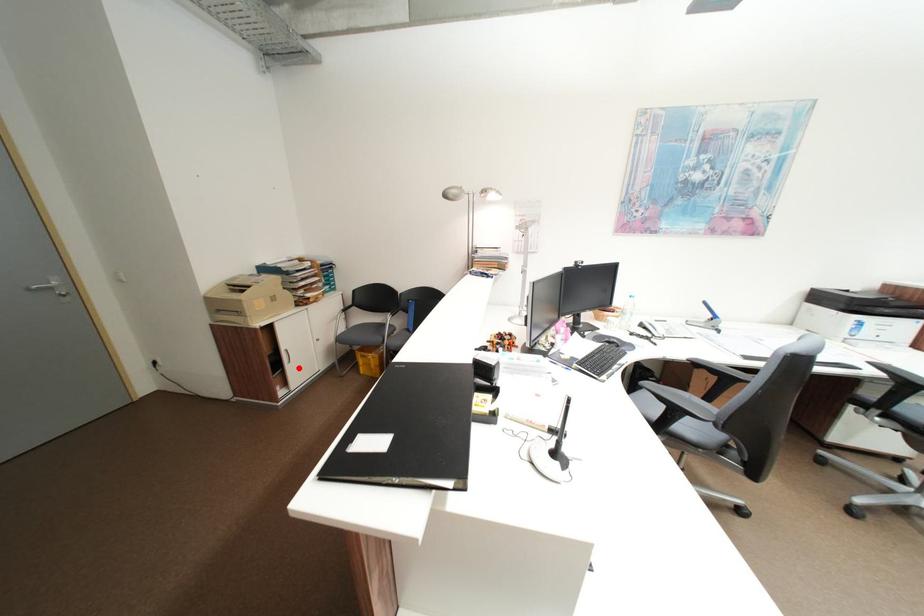
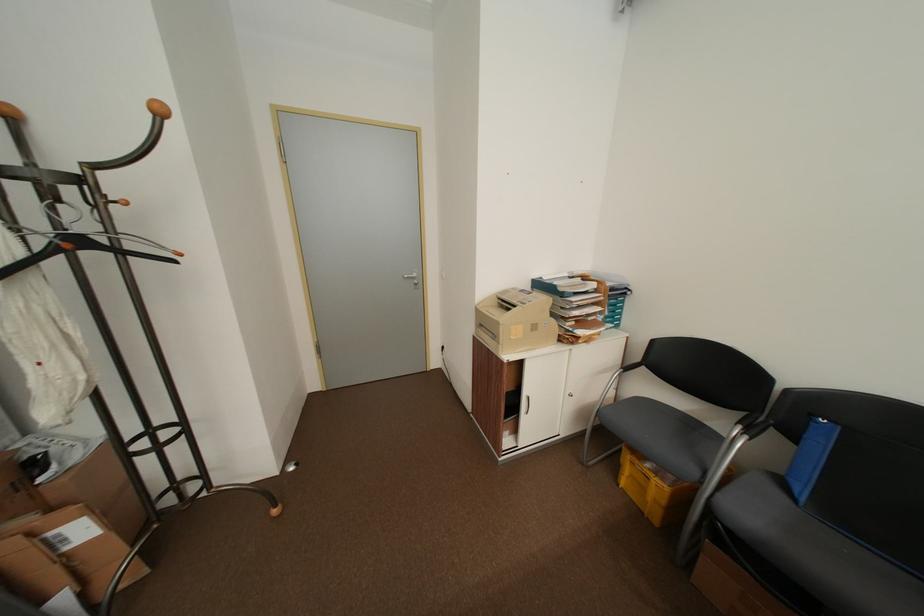
Locate, in the second image, the point that corresponds to the highlighted location in the first image.

(535, 419)